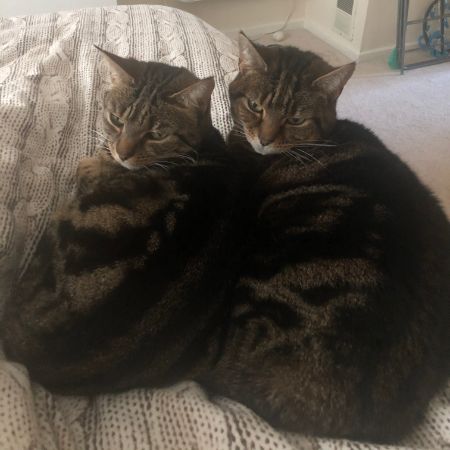
Find the location of a particular element. The image size is (450, 450). floor is located at coordinates (398, 122).